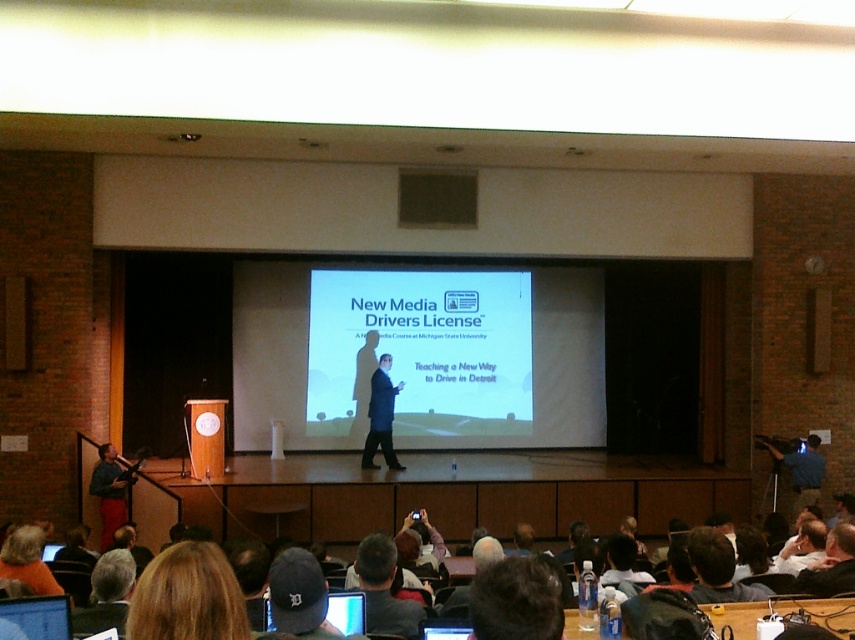
From the picture: Does gray fabric shirt at lower center appear over blue fabric camera at lower right?

Correct, gray fabric shirt at lower center is located above blue fabric camera at lower right.

Is gray fabric shirt at lower center bigger than blue fabric camera at lower right?

No, gray fabric shirt at lower center is not bigger than blue fabric camera at lower right.

I want to click on gray fabric shirt at lower center, so click(384, 589).

This screenshot has width=855, height=640. I want to click on gray fabric shirt at lower center, so click(x=384, y=589).

Between point (326, 378) and point (394, 556), which one is positioned in front?

Positioned in front is point (394, 556).

Which is more to the right, white matte projection screen at center or gray fabric shirt at lower center?

From the viewer's perspective, gray fabric shirt at lower center appears more on the right side.

Find the location of a particular element. This screenshot has height=640, width=855. white matte projection screen at center is located at coordinates (422, 349).

The width and height of the screenshot is (855, 640). Identify the location of white matte projection screen at center. (422, 349).

Which of these two, white matte projection screen at center or blue fabric camera at lower right, stands shorter?

With less height is blue fabric camera at lower right.

Which is in front, point (496, 396) or point (818, 461)?

Point (818, 461)

Image resolution: width=855 pixels, height=640 pixels. I want to click on white matte projection screen at center, so click(x=422, y=349).